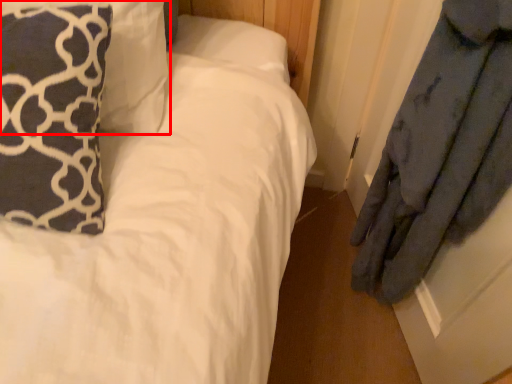
Question: Considering the relative positions of pillow (annotated by the red box) and pillow in the image provided, where is pillow (annotated by the red box) located with respect to the staircase?

Choices:
 (A) right
 (B) left

Answer: (A)